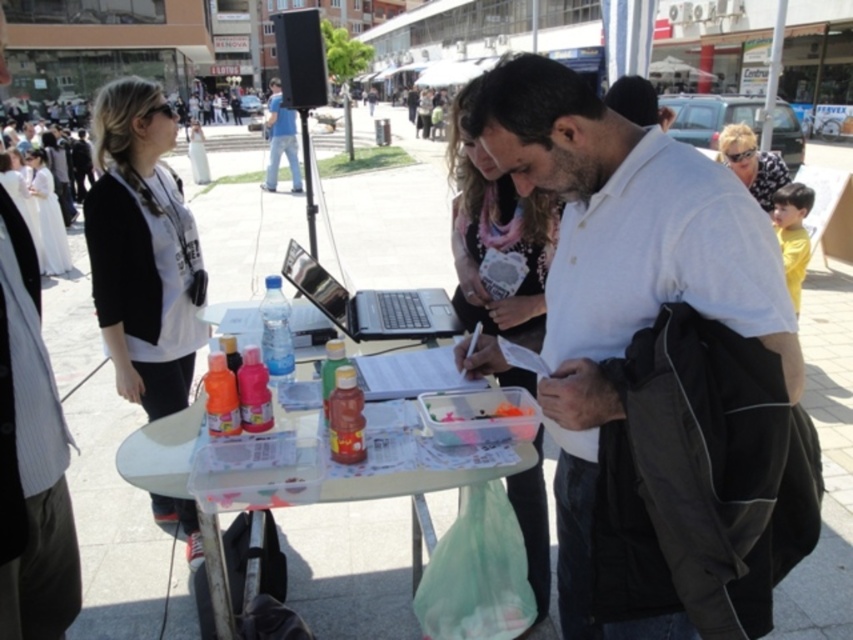
Please describe the object located at point (480, 416) in the image. Use the scene description to help you.

The point (480, 416) is on the translucent plastic container at center.

From the picture: You are standing at the edge of the plaza looking at the table. Which of the two points, point (427, 547) or point (271, 92), is closer to you?

Point (427, 547) is closer to the camera than point (271, 92), so it is closer to you.